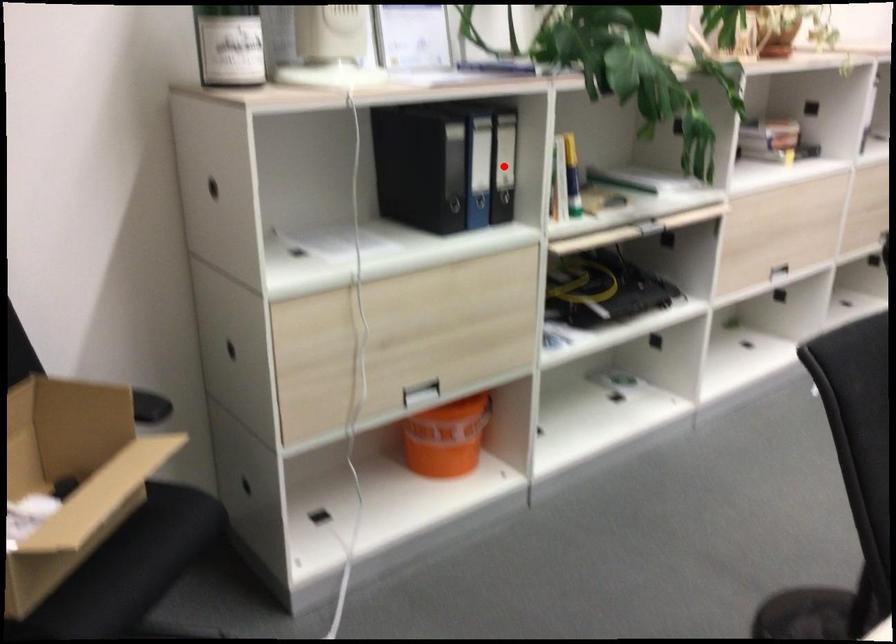
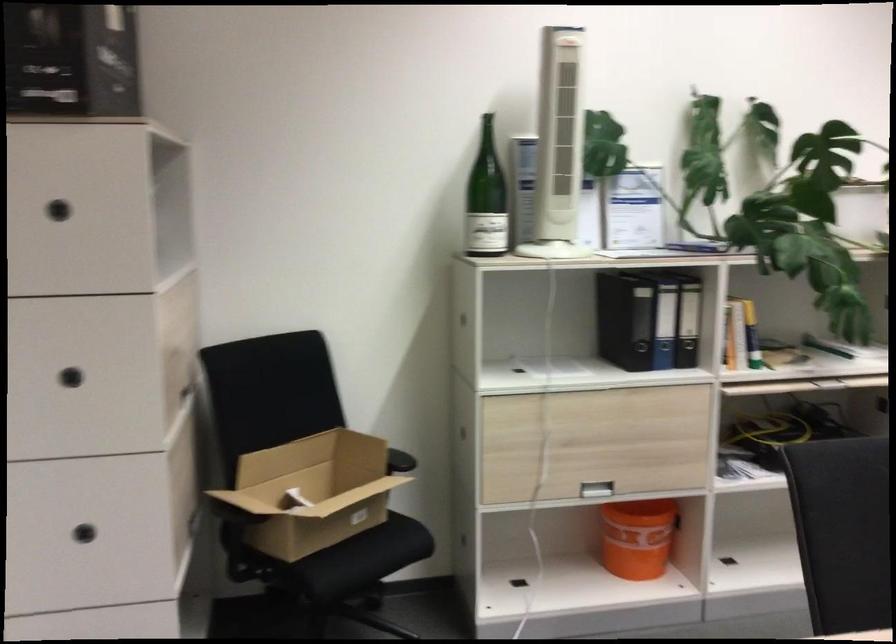
Question: I am providing you with two images of the same scene from different viewpoints. Given a red point in image1, look at the same physical point in image2. Is it:

Choices:
 (A) Closer to the viewpoint
 (B) Farther from the viewpoint

Answer: (B)